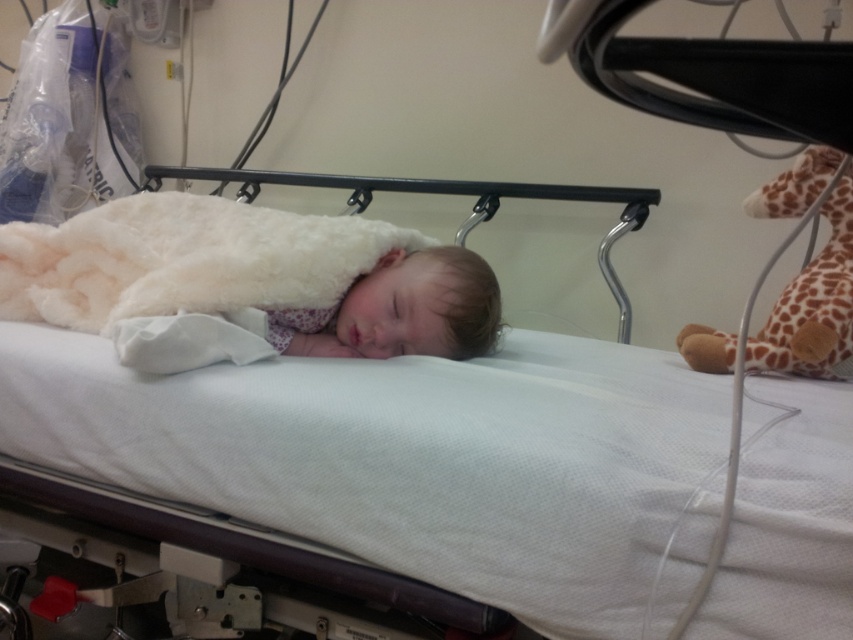
Question: Which point appears closest to the camera in this image?

Choices:
 (A) (270, 221)
 (B) (57, 342)

Answer: (B)

Question: Is white fabric infant bed at center thinner than white fluffy blanket at center?

Choices:
 (A) no
 (B) yes

Answer: (A)

Question: Which of the following is the closest to the observer?

Choices:
 (A) (120, 285)
 (B) (523, 333)

Answer: (A)

Question: Can you confirm if white fabric infant bed at center is bigger than white fluffy blanket at center?

Choices:
 (A) no
 (B) yes

Answer: (B)

Question: Does white fabric infant bed at center appear over white fluffy blanket at center?

Choices:
 (A) no
 (B) yes

Answer: (A)